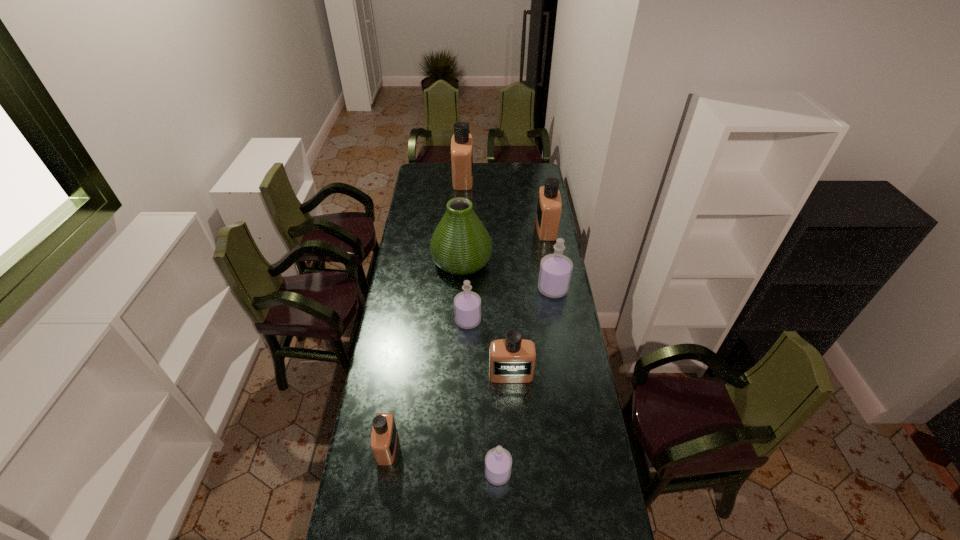
At what (x,y) coordinates should I click in order to perform the action: click on vacant area situated on the left of the rightmost purple perfume. Please return your answer as a coordinate pair (x, y). Looking at the image, I should click on [x=495, y=289].

Find the location of a particular element. The height and width of the screenshot is (540, 960). blank space located 0.340m on the back of the second nearest purple perfume is located at coordinates (469, 260).

This screenshot has width=960, height=540. Identify the location of vacant region located 0.220m on the front label of the second smallest beige perfume. (515, 437).

Find the location of a particular element. vacant space situated on the right of the smallest purple perfume is located at coordinates (597, 473).

The width and height of the screenshot is (960, 540). In order to click on vacant space situated 0.350m on the front label of the leftmost object in this screenshot , I will do `click(497, 447)`.

Image resolution: width=960 pixels, height=540 pixels. I want to click on object at the far edge, so click(462, 142).

Identify the location of object present at the left edge. The width and height of the screenshot is (960, 540). (384, 435).

Find the location of a particular element. The height and width of the screenshot is (540, 960). vacant space at the far edge of the desktop is located at coordinates (509, 164).

Find the location of a particular element. Image resolution: width=960 pixels, height=540 pixels. free point at the left edge is located at coordinates (414, 357).

You are a GUI agent. You are given a task and a screenshot of the screen. Output one action in this format:
    pyautogui.click(x=<x>, y=<y>)
    Task: Click on the free point at the right edge
    
    Given the screenshot: What is the action you would take?
    pyautogui.click(x=574, y=376)